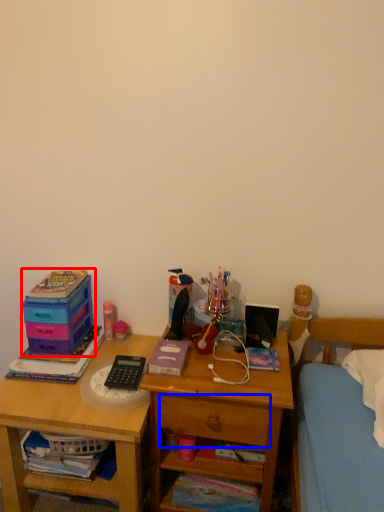
Question: Which of the following is the farthest to the observer, storage box (highlighted by a red box) or drawer (highlighted by a blue box)?

Choices:
 (A) storage box
 (B) drawer

Answer: (A)